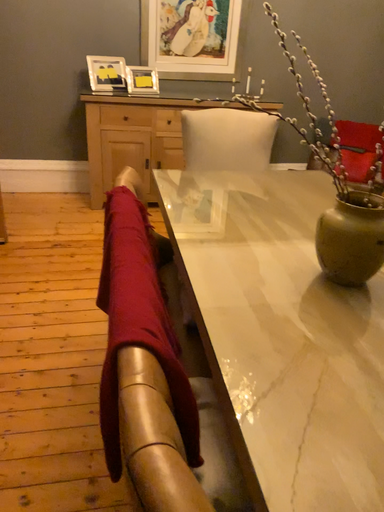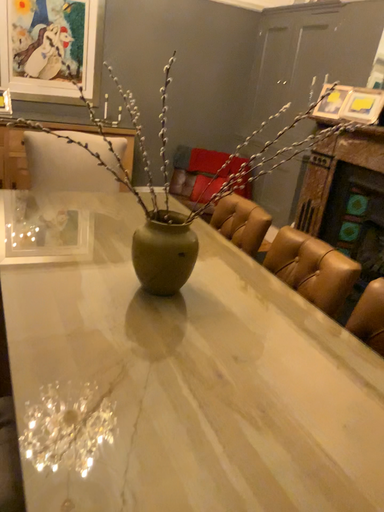
Question: Which way did the camera rotate in the video?

Choices:
 (A) rotated right
 (B) rotated left

Answer: (A)